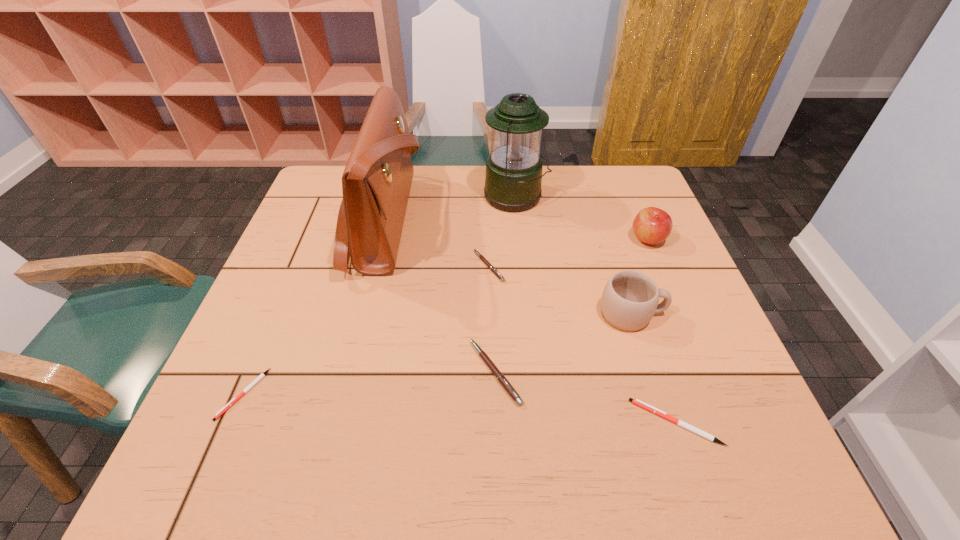
Identify the location of satchel. (376, 182).

Locate an element on the screen. the second object from left to right is located at coordinates (376, 182).

Where is `lantern`? The width and height of the screenshot is (960, 540). lantern is located at coordinates (513, 178).

I want to click on apple, so click(x=652, y=225).

Image resolution: width=960 pixels, height=540 pixels. I want to click on mug, so click(630, 299).

Locate an element on the screen. the nearer pink pen is located at coordinates (501, 378).

What are the coordinates of `the bigger pink pen` in the screenshot? It's located at (501, 378).

Identify the location of the farthest pen. (492, 268).

Locate an element on the screen. The image size is (960, 540). the farther pink pen is located at coordinates (492, 268).

Identify the location of the rightmost pen. Image resolution: width=960 pixels, height=540 pixels. (637, 402).